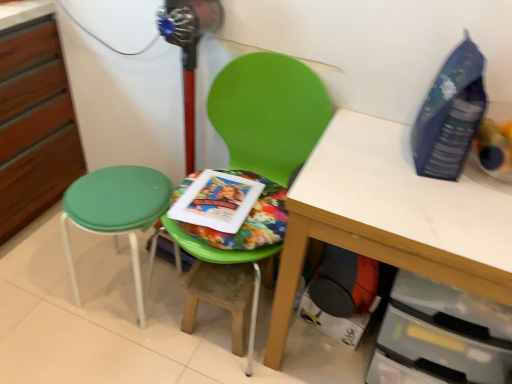
Find the location of a particular element. The image size is (512, 384). blue plastic bottle at upper right is located at coordinates (450, 115).

What is the approximate width of blue plastic bottle at upper right?

It is 10.28 inches.

Locate an element on the screen. This screenshot has width=512, height=384. multicolored fabric paperback book at center is located at coordinates (216, 200).

At what (x,y) coordinates should I click in order to perform the action: click on wooden step stool at center. Please return your answer as a coordinate pair (x, y). This screenshot has height=384, width=512. Looking at the image, I should click on (221, 296).

What is the approximate width of green plastic chair at center?

54.61 centimeters.

What do you see at coordinates (116, 211) in the screenshot? This screenshot has height=384, width=512. I see `green fabric stool at left` at bounding box center [116, 211].

Where is `blue plastic bottle at upper right`? The height and width of the screenshot is (384, 512). blue plastic bottle at upper right is located at coordinates (450, 115).

What's the angular difference between green fabric stool at left and multicolored fabric paperback book at center's facing directions?

3.41 degrees.

From a real-world perspective, is green fabric stool at left physically located above or below multicolored fabric paperback book at center?

green fabric stool at left is situated lower than multicolored fabric paperback book at center in the real world.

From the image's perspective, who appears lower, green fabric stool at left or multicolored fabric paperback book at center?

green fabric stool at left is shown below in the image.

Who is taller, green fabric stool at left or multicolored fabric paperback book at center?

With more height is green fabric stool at left.

Which of these two, multicolored fabric paperback book at center or wooden step stool at center, is thinner?

Thinner between the two is multicolored fabric paperback book at center.

Is multicolored fabric paperback book at center not near wooden step stool at center?

multicolored fabric paperback book at center is near wooden step stool at center, not far away.

Is multicolored fabric paperback book at center taller or shorter than wooden step stool at center?

multicolored fabric paperback book at center is shorter than wooden step stool at center.

Find the location of a particular element. Image resolution: width=512 pixels, height=384 pixels. bottle above the wooden step stool at center (from the image's perspective) is located at coordinates (450, 115).

Would you say blue plastic bottle at upper right is part of wooden step stool at center's contents?

No, blue plastic bottle at upper right is not surrounded by wooden step stool at center.

Who is more distant, wooden step stool at center or blue plastic bottle at upper right?

wooden step stool at center is further away from the camera.

Can you confirm if wooden step stool at center is positioned to the left of blue plastic bottle at upper right?

Yes.

Locate an element on the screen. bottle in front of the wooden step stool at center is located at coordinates (450, 115).

Which object is closer to the camera taking this photo, blue plastic bottle at upper right or wooden step stool at center?

blue plastic bottle at upper right is in front.

Is blue plastic bottle at upper right facing away from wooden step stool at center?

That's not correct — blue plastic bottle at upper right is not looking away from wooden step stool at center.

From the image's perspective, is multicolored fabric paperback book at center on top of green plastic chair at center?

Yes, from the image's perspective, multicolored fabric paperback book at center is on top of green plastic chair at center.

Considering the relative sizes of multicolored fabric paperback book at center and green plastic chair at center in the image provided, is multicolored fabric paperback book at center wider than green plastic chair at center?

No, multicolored fabric paperback book at center is not wider than green plastic chair at center.

From the image's perspective, which is above, white matte table at center or green fabric stool at left?

green fabric stool at left, from the image's perspective.

Is white matte table at center not near green fabric stool at left?

No, white matte table at center is not far away from green fabric stool at left.

Which of these two, white matte table at center or green fabric stool at left, is bigger?

With larger size is white matte table at center.

From a real-world perspective, between white matte table at center and green fabric stool at left, who is vertically lower?

green fabric stool at left.

Which object is positioned more to the left, multicolored fabric paperback book at center or green fabric stool at left?

green fabric stool at left.

Is green fabric stool at left at the back of multicolored fabric paperback book at center?

multicolored fabric paperback book at center does not have its back to green fabric stool at left.

How different are the orientations of multicolored fabric paperback book at center and green fabric stool at left in degrees?

multicolored fabric paperback book at center and green fabric stool at left are facing 3.41 degrees away from each other.

Considering the relative sizes of multicolored fabric paperback book at center and green fabric stool at left in the image provided, is multicolored fabric paperback book at center taller than green fabric stool at left?

No.

The width and height of the screenshot is (512, 384). I want to click on paperback book that appears above the green fabric stool at left (from a real-world perspective), so click(216, 200).

Where is `step stool below the multicolored fabric paperback book at center (from the image's perspective)`? step stool below the multicolored fabric paperback book at center (from the image's perspective) is located at coordinates (221, 296).

Looking at the image, which one is located further to white matte table at center, green fabric stool at left or blue plastic bottle at upper right?

The object further to white matte table at center is green fabric stool at left.

Considering their positions, is green fabric stool at left positioned further to wooden step stool at center than white matte table at center?

white matte table at center is further to wooden step stool at center.

Looking at the image, which one is located closer to multicolored fabric paperback book at center, green plastic chair at center or wooden step stool at center?

green plastic chair at center is positioned closer to the anchor multicolored fabric paperback book at center.

Looking at the image, which one is located closer to blue plastic bottle at upper right, green fabric stool at left or green plastic chair at center?

green plastic chair at center.

From the image, which object appears to be farther from green fabric stool at left, blue plastic bottle at upper right or green plastic chair at center?

The object further to green fabric stool at left is blue plastic bottle at upper right.

Looking at the image, which one is located further to green fabric stool at left, blue plastic bottle at upper right or multicolored fabric paperback book at center?

The object further to green fabric stool at left is blue plastic bottle at upper right.

Looking at the image, which one is located further to multicolored fabric paperback book at center, blue plastic bottle at upper right or green plastic chair at center?

blue plastic bottle at upper right is positioned further to the anchor multicolored fabric paperback book at center.

Which object lies nearer to the anchor point green plastic chair at center, wooden step stool at center or white matte table at center?

The object closer to green plastic chair at center is white matte table at center.

At what (x,y) coordinates should I click in order to perform the action: click on bottle between multicolored fabric paperback book at center and white matte table at center. Please return your answer as a coordinate pair (x, y). This screenshot has width=512, height=384. Looking at the image, I should click on (450, 115).

Locate an element on the screen. This screenshot has height=384, width=512. paperback book located between green fabric stool at left and white matte table at center in the left-right direction is located at coordinates (216, 200).

Find the location of a particular element. paperback book located between green fabric stool at left and wooden step stool at center in the left-right direction is located at coordinates (x=216, y=200).

The height and width of the screenshot is (384, 512). I want to click on paperback book located between green fabric stool at left and blue plastic bottle at upper right in the left-right direction, so 216,200.